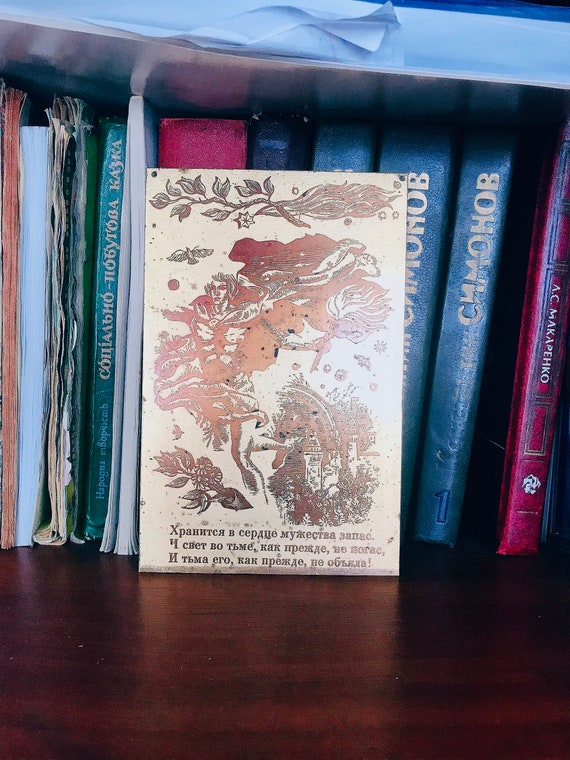
Where is `booklet`? This screenshot has width=570, height=760. booklet is located at coordinates (130, 160).